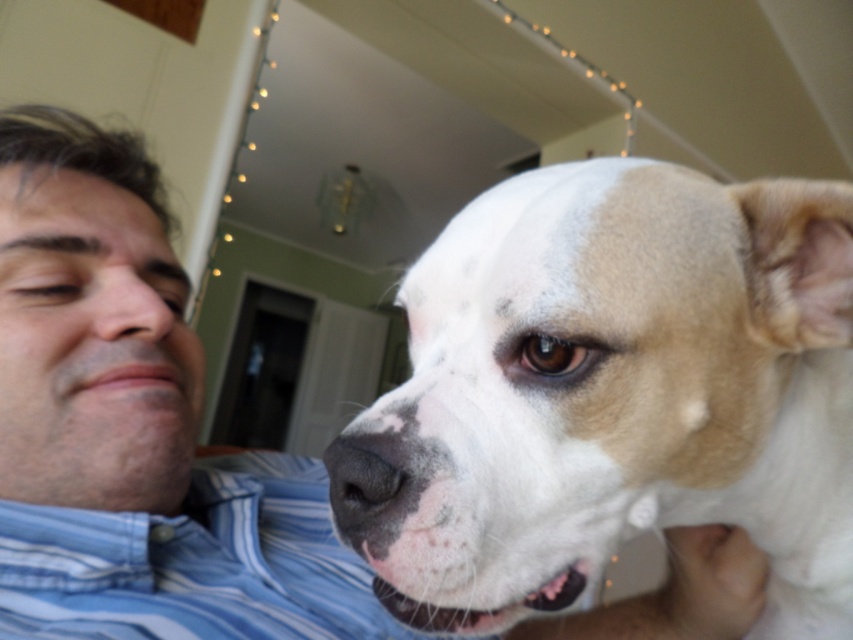
Consider the image. You are a photographer taking a picture of the blue striped shirt at lower left and the matte skin nose at left. Which object is closer to your camera lens?

The blue striped shirt at lower left is closer to the viewer than the matte skin nose at left, so the blue striped shirt at lower left would be closer to the camera lens.

You are a photographer trying to capture a close shot of the blue striped shirt at lower left and the matte skin nose at left. Which object should you zoom in on to ensure both are in focus without moving the camera?

The blue striped shirt at lower left has a larger size compared to matte skin nose at left, so you should zoom in on the blue striped shirt at lower left to ensure both are in focus without moving the camera.

You are a photographer taking a picture of a man and his dog in a home setting. The man is wearing a blue striped shirt at lower left. To ensure the shirt is visible in the photo, where should you position the camera relative to the shirt?

The blue striped shirt at lower left is positioned at point 0.881 on the x axis and 0.227 on the y axis. To ensure visibility, the camera should be positioned so it can capture the lower left area of the frame where the shirt is located.